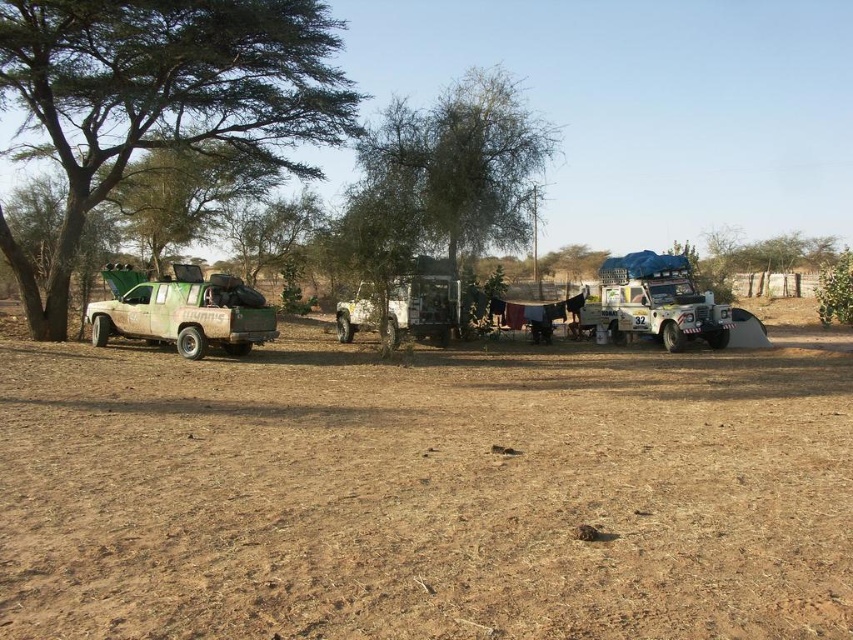
You are a driver trying to park your car in the rural area shown. You see the brown dry soil at center and the metallic silver jeep at center. Which area is wider for parking?

The brown dry soil at center is wider than the metallic silver jeep at center, so the brown dry soil at center provides a wider area for parking.